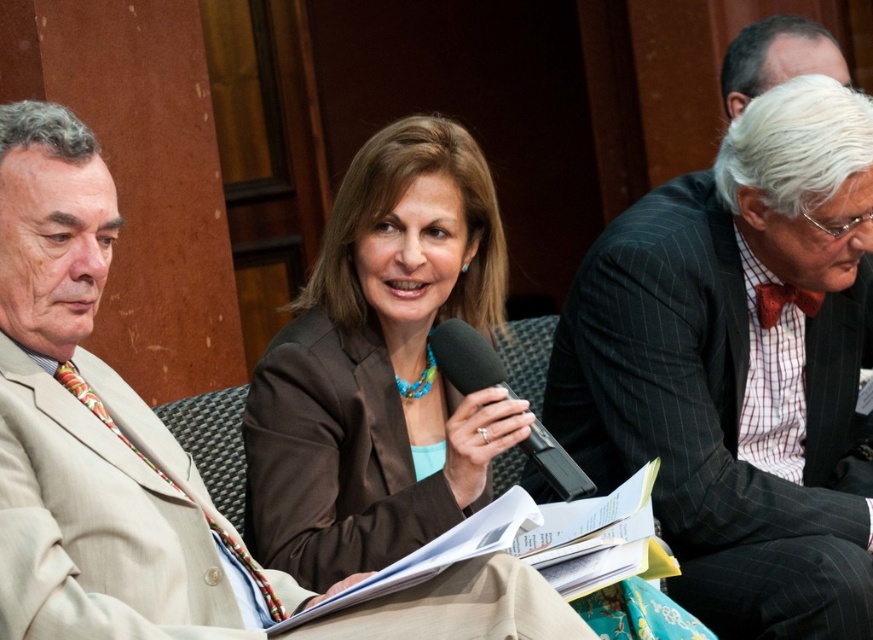
Which is more to the left, beige textured suit at left or black matte microphone at center?

beige textured suit at left

Can you confirm if beige textured suit at left is bigger than black matte microphone at center?

Indeed, beige textured suit at left has a larger size compared to black matte microphone at center.

You are a GUI agent. You are given a task and a screenshot of the screen. Output one action in this format:
    pyautogui.click(x=<x>, y=<y>)
    Task: Click on the beige textured suit at left
    
    Given the screenshot: What is the action you would take?
    pyautogui.click(x=95, y=433)

Measure the distance between dark gray pinstripe suit at right and beige textured suit at left.

dark gray pinstripe suit at right is 7.03 feet from beige textured suit at left.

Does point (693, 406) come behind point (95, 561)?

That is True.

You are a GUI agent. You are given a task and a screenshot of the screen. Output one action in this format:
    pyautogui.click(x=<x>, y=<y>)
    Task: Click on the dark gray pinstripe suit at right
    
    Given the screenshot: What is the action you would take?
    pyautogui.click(x=739, y=365)

In the scene shown: Can you confirm if dark gray pinstripe suit at right is thinner than black matte microphone at center?

Incorrect, dark gray pinstripe suit at right's width is not less than black matte microphone at center's.

Who is lower down, dark gray pinstripe suit at right or black matte microphone at center?

black matte microphone at center

In order to click on dark gray pinstripe suit at right in this screenshot , I will do [x=739, y=365].